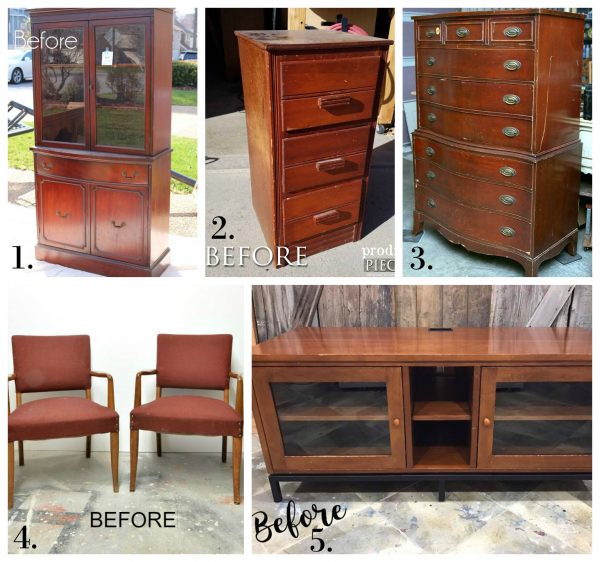
Find the location of a particular element. The image size is (600, 562). brown chest of drawers with lots of drawer, looks old and beaten up is located at coordinates [x=475, y=225].